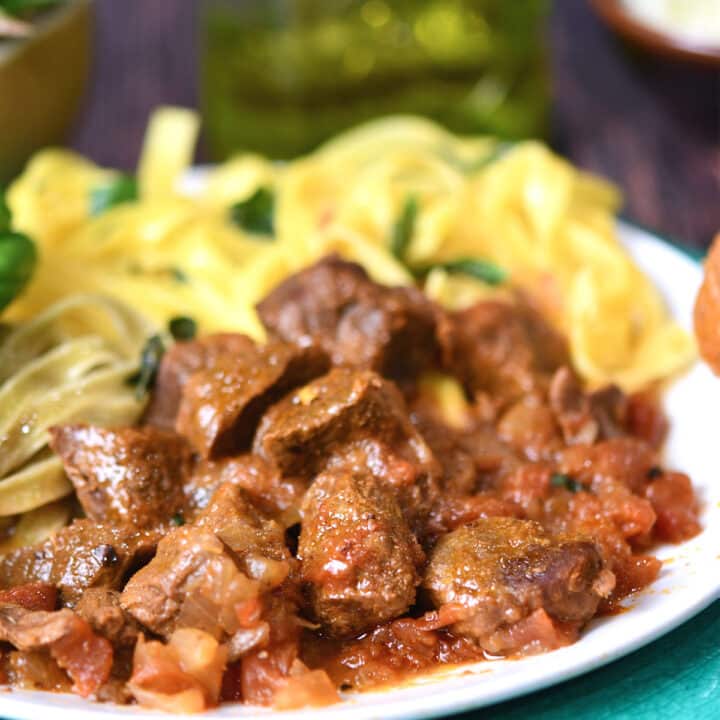
Image resolution: width=720 pixels, height=720 pixels. What are the coordinates of `green glass` in the screenshot? It's located at (477, 50).